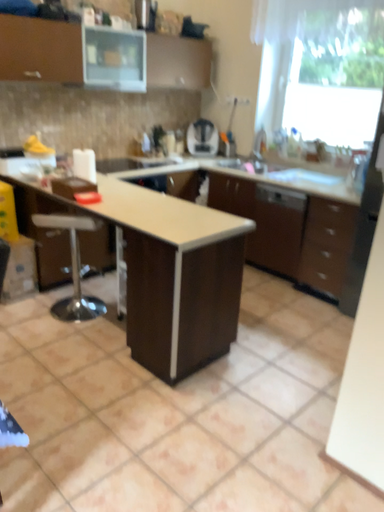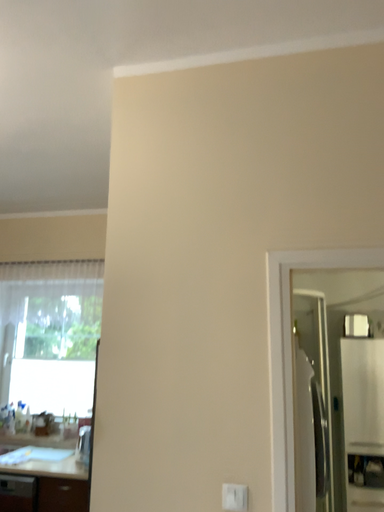
Question: How did the camera likely rotate when shooting the video?

Choices:
 (A) rotated upward
 (B) rotated downward

Answer: (A)